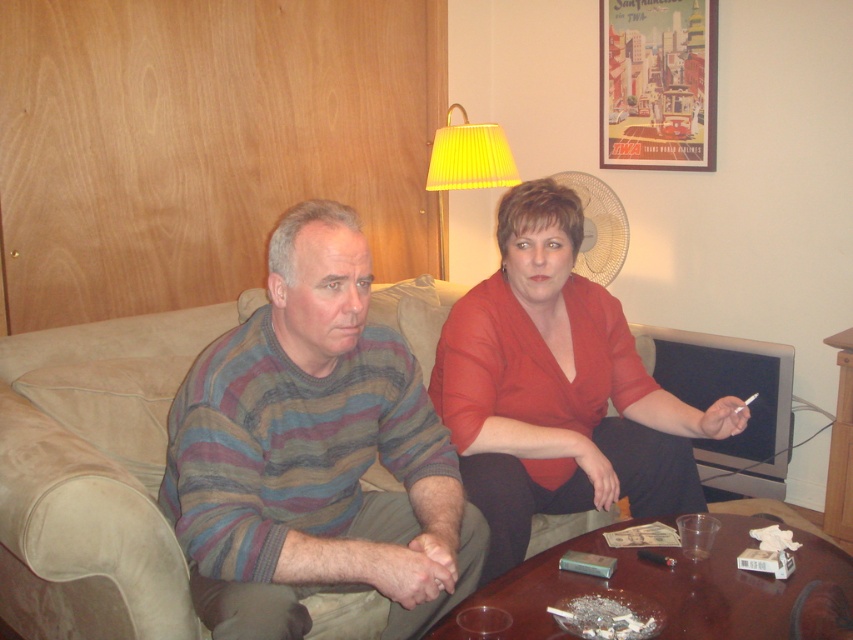
Is point (386, 524) positioned in front of point (595, 342)?

That is True.

Between point (259, 550) and point (711, 426), which one is positioned in front?

Point (259, 550) is in front.

Describe the element at coordinates (314, 452) in the screenshot. This screenshot has width=853, height=640. I see `striped sweater at center` at that location.

Image resolution: width=853 pixels, height=640 pixels. What are the coordinates of `striped sweater at center` in the screenshot? It's located at (314, 452).

Who is positioned more to the left, matte red blouse at center or yellow pleated shade at upper center?

yellow pleated shade at upper center is more to the left.

Is point (689, 509) positioned after point (509, 157)?

No, (689, 509) is in front of (509, 157).

You are a GUI agent. You are given a task and a screenshot of the screen. Output one action in this format:
    pyautogui.click(x=<x>, y=<y>)
    Task: Click on the matte red blouse at center
    This screenshot has height=640, width=853.
    Given the screenshot: What is the action you would take?
    pyautogui.click(x=558, y=388)

Between striped sweater at center and suede couch at center, which one has less height?

With less height is striped sweater at center.

Does striped sweater at center appear on the right side of suede couch at center?

Indeed, striped sweater at center is positioned on the right side of suede couch at center.

This screenshot has width=853, height=640. What do you see at coordinates (314, 452) in the screenshot? I see `striped sweater at center` at bounding box center [314, 452].

Locate an element on the screen. Image resolution: width=853 pixels, height=640 pixels. striped sweater at center is located at coordinates (314, 452).